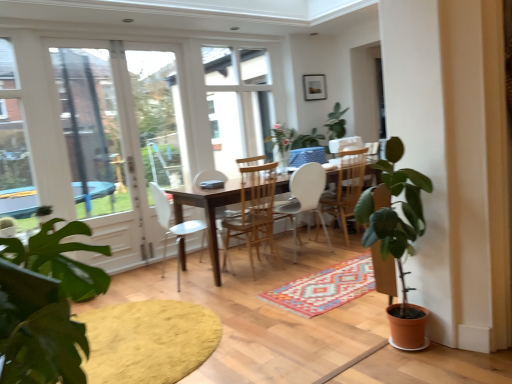
I want to click on vacant area that is in front of wooden chair at center, the second chair in the left-to-right sequence, so coord(245,284).